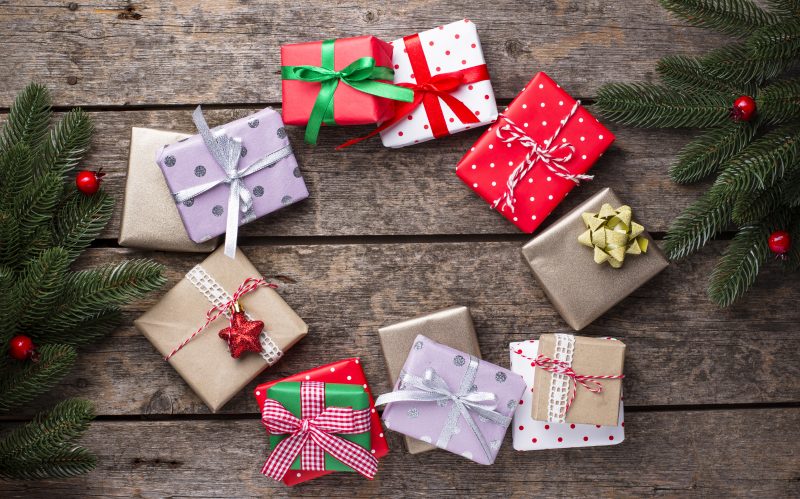
Image resolution: width=800 pixels, height=499 pixels. In order to click on christmas ornaments in this screenshot , I will do `click(86, 177)`, `click(24, 348)`, `click(786, 242)`, `click(746, 115)`, `click(250, 342)`.